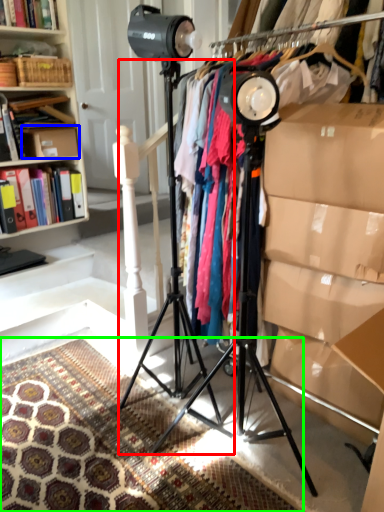
Question: Based on their relative distances, which object is nearer to tripod (highlighted by a red box)? Choose from cardboard box (highlighted by a blue box) and mat (highlighted by a green box).

Choices:
 (A) cardboard box
 (B) mat

Answer: (B)